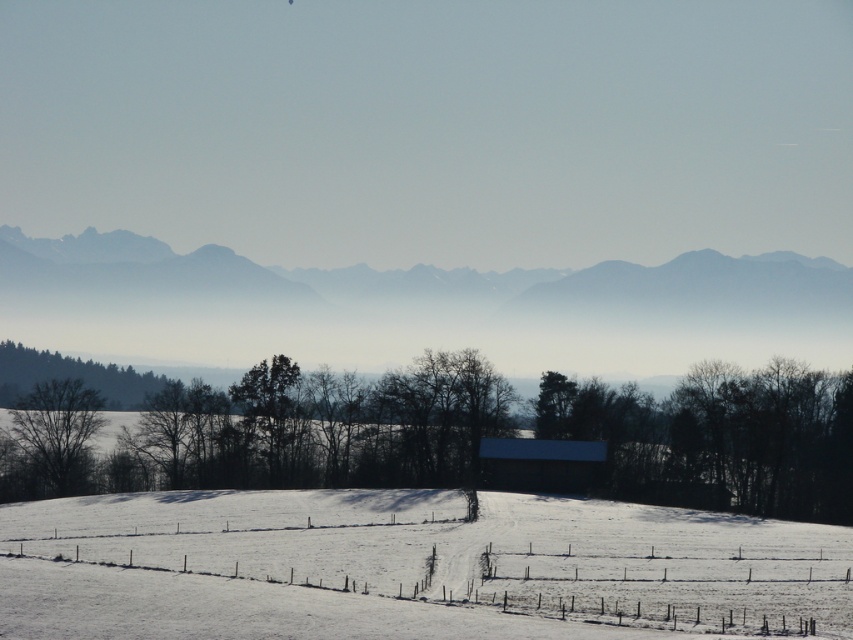
You are an outdoor photographer planning to capture the white wooden fence at lower center and the gray foggy mountain at center. Based on the scene, which object should you position to the right side of your camera frame to include both in the shot?

You should position the white wooden fence at lower center to the right side of your camera frame because the gray foggy mountain at center is located to the left of it.

Consider the image. You are standing in the snow field and want to walk to the barn. You have two points marked on your map, point A at coordinates point (x=643, y=396) and point B at coordinates point (x=251, y=589). Which point is closer to you?

Point A at coordinates point (x=643, y=396) is closer to you because it is further to the viewer than point B at coordinates point (x=251, y=589).